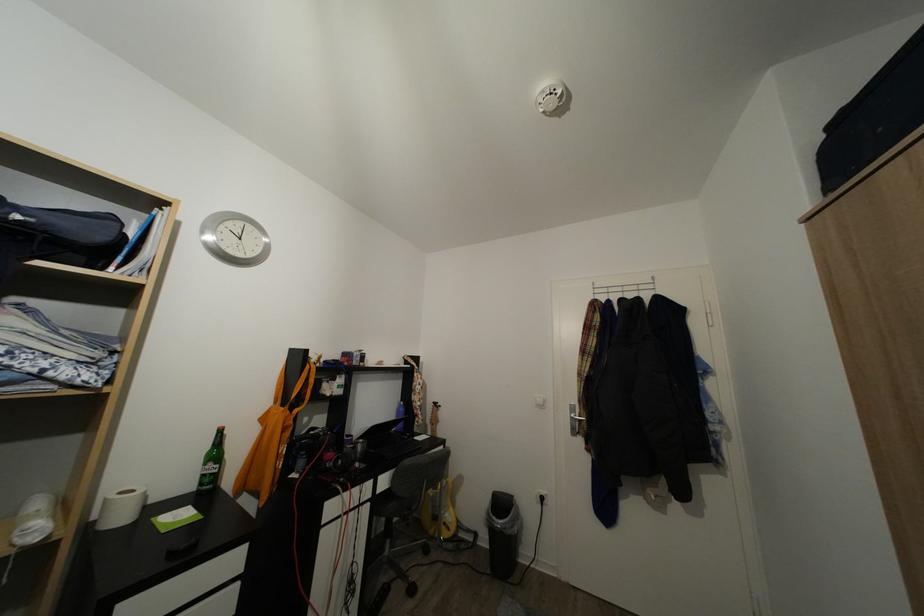
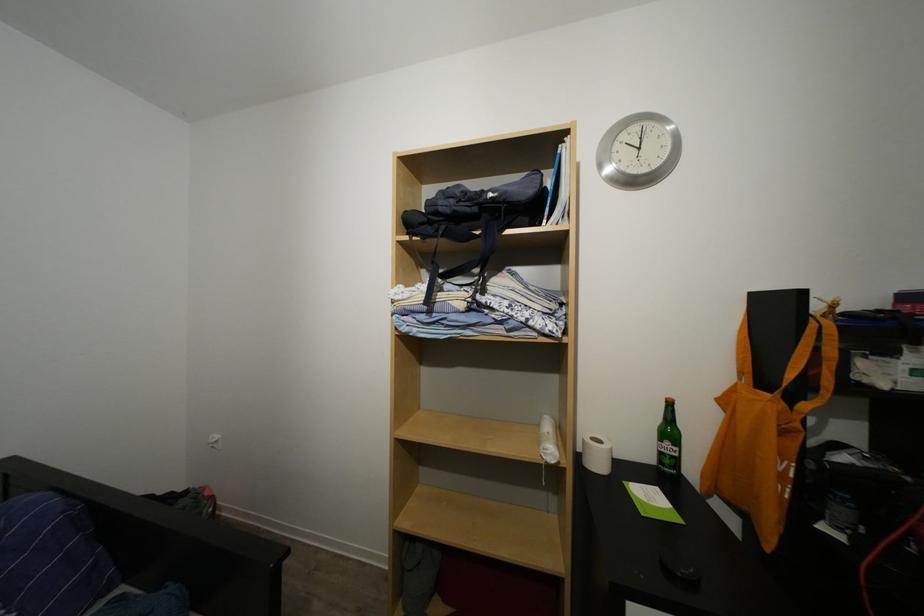
In the second image, find the point that corresponds to pixel 343 386 in the first image.

(900, 360)